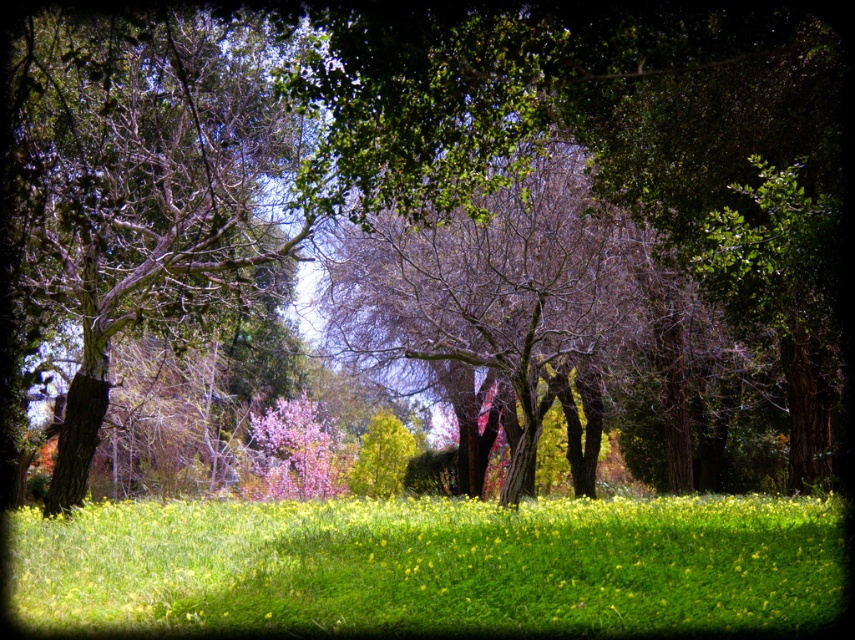
Is smooth bark tree at left positioned behind pink silky blossoms at center?

No.

Between point (74, 461) and point (302, 424), which one is positioned in front?

Point (74, 461)

Is point (146, 179) farther from camera compared to point (301, 397)?

No, (146, 179) is closer to viewer.

Locate an element on the screen. smooth bark tree at left is located at coordinates tap(137, 186).

Is green grass at lower center taller than pink silky blossoms at center?

Yes, green grass at lower center is taller than pink silky blossoms at center.

Which is more to the right, green grass at lower center or pink silky blossoms at center?

From the viewer's perspective, green grass at lower center appears more on the right side.

Is point (441, 515) farther from camera compared to point (335, 458)?

That is False.

Where is `green grass at lower center`? green grass at lower center is located at coordinates (x=433, y=564).

At what (x,y) coordinates should I click in order to perform the action: click on green leafy tree at center. Please return your answer as a coordinate pair (x, y). Image resolution: width=855 pixels, height=640 pixels. Looking at the image, I should click on (622, 129).

From the picture: Between green leafy tree at center and smooth bark tree at left, which one has more height?

smooth bark tree at left

Is point (659, 161) positioned behind point (137, 186)?

No.

Image resolution: width=855 pixels, height=640 pixels. I want to click on green leafy tree at center, so click(622, 129).